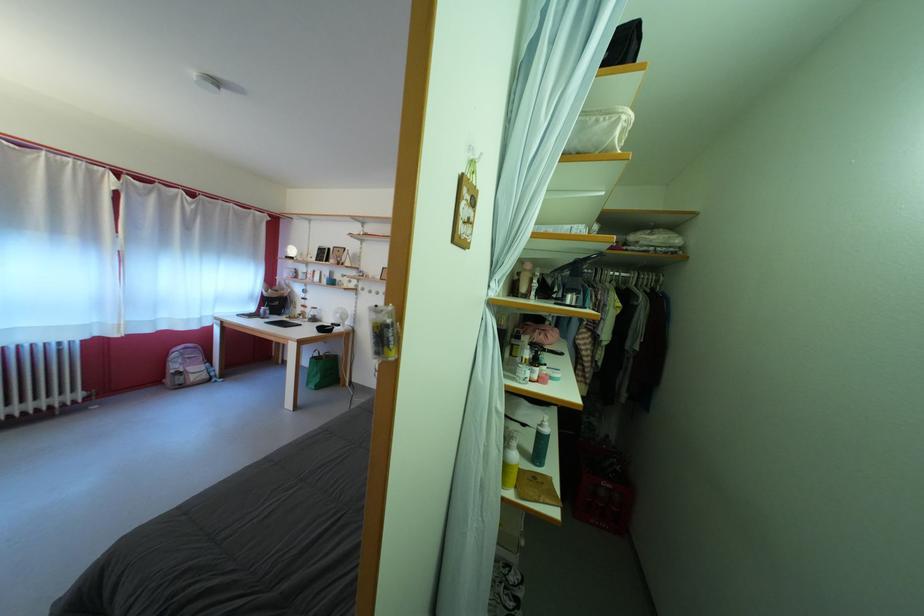
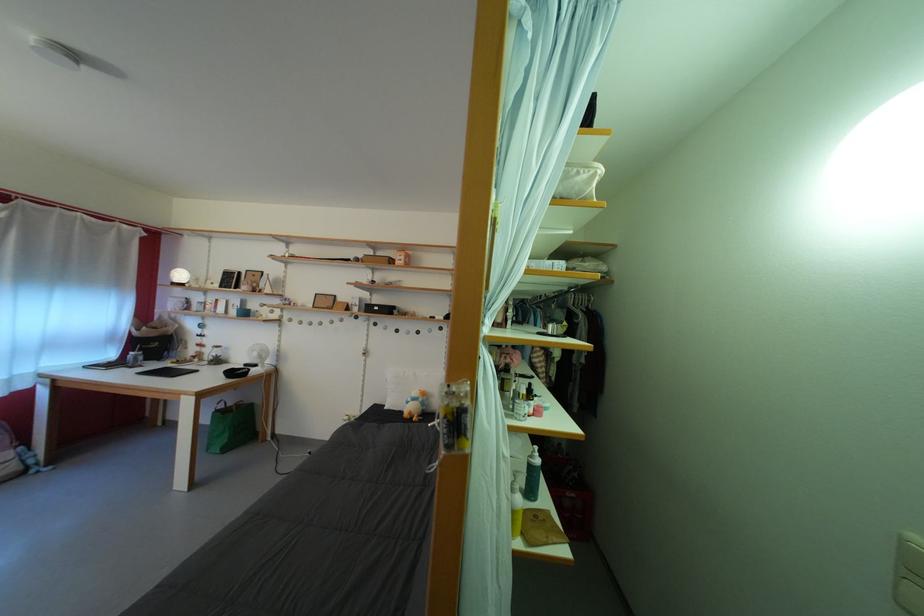
Question: The camera is either moving clockwise (left) or counter-clockwise (right) around the object. The first image is from the beginning of the video and the second image is from the end. Is the camera moving left or right when shooting the video?

Choices:
 (A) Left
 (B) Right

Answer: (A)